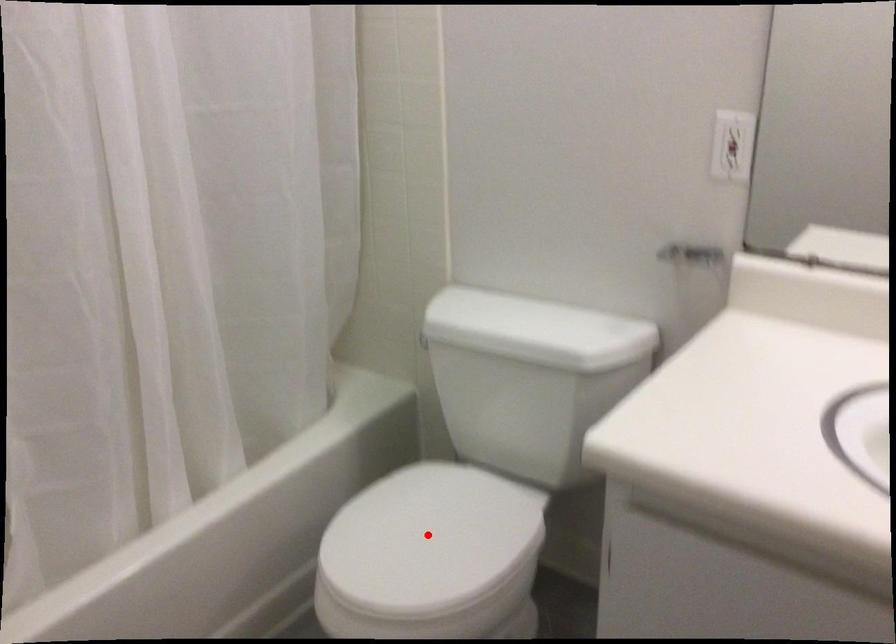
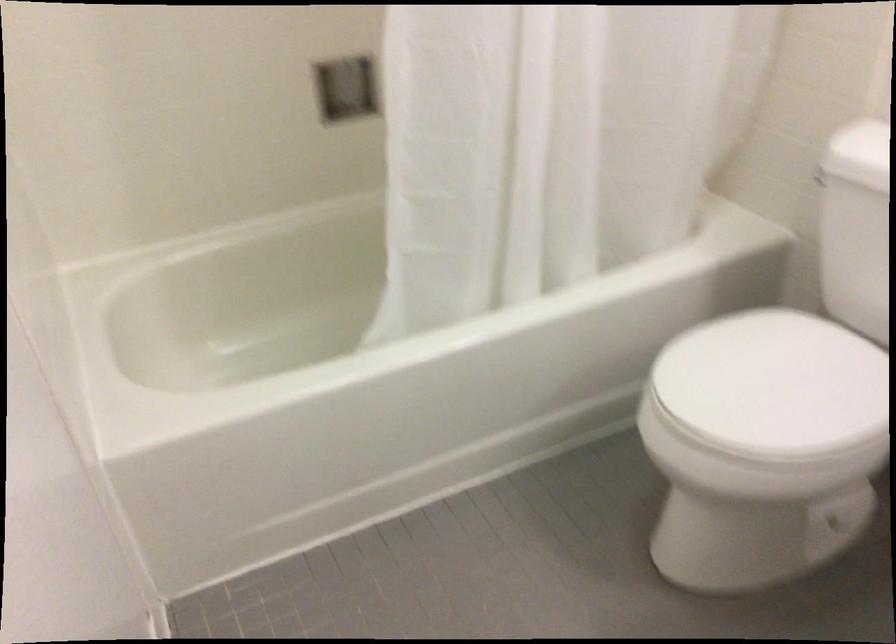
Find the pixel in the second image that matches the highlighted location in the first image.

(773, 384)